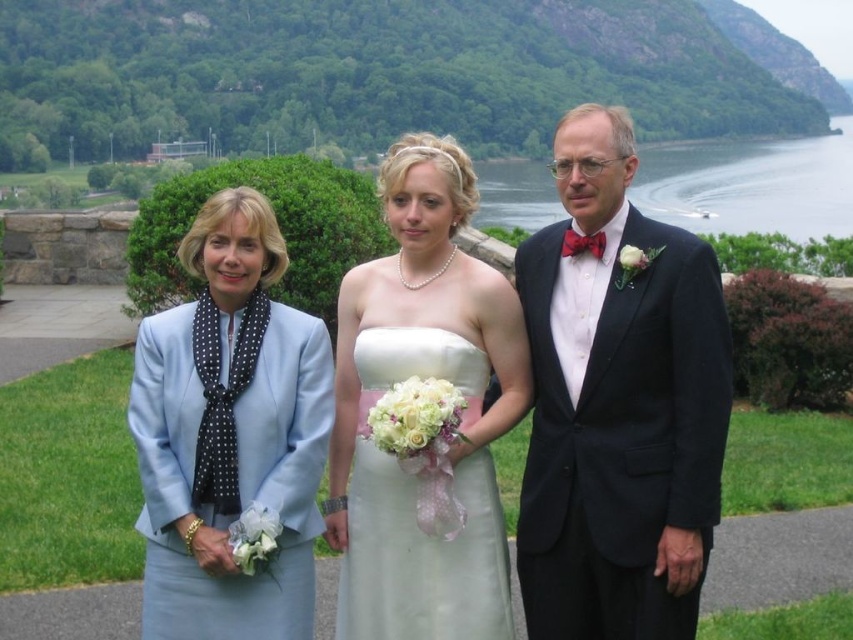
What are the coordinates of the white satin dress at center?

The white satin dress at center is located at coordinates (421, 557).

You are a photographer standing at the camera position. The white satin dress at center is part of the wedding party. You want to ensure the dress is in focus while the background remains slightly blurred. Given the dress is 10.71 meters away, what adjustment should you make to the camera settings?

To achieve a blurred background while focusing on the white satin dress at center, set the camera to a wide aperture to create a shallow depth of field. Since the dress is 10.71 meters away, adjusting the focus distance to match that will ensure it is sharp while the background is out of focus.